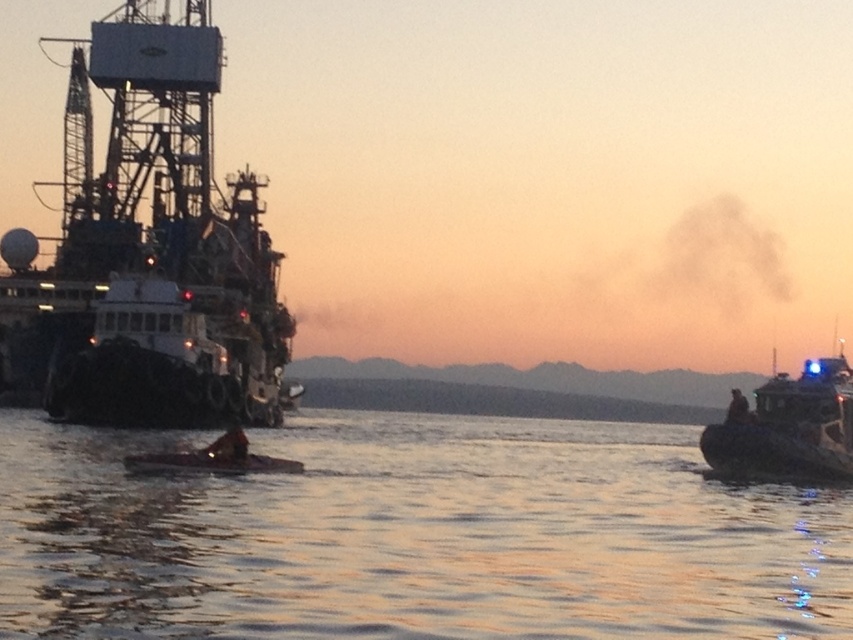
You are a photographer standing at the camera position capturing this harbor scene. You want to take a closeup shot of the white plastic boat at right. Given that your telephoto lens can focus on objects up to 200 feet away, will you be able to capture a clear closeup of the boat?

The white plastic boat at right is 207.64 feet away from the camera. Since the telephoto lens can only focus up to 200 feet, it will not be able to capture a clear closeup of the boat.

You are a sailor navigating a narrow channel between two ships. You see the smooth water at center and the white matte ship at left. Which object is located to the right of the other?

The smooth water at center is positioned on the right side of white matte ship at left, so the smooth water at center is to the right of the white matte ship at left.

You are a photographer standing at the harbor during sunset. You notice a white matte ship at left and a dark blue uniform at center. Which object is taller?

The white matte ship at left is taller than the dark blue uniform at center.